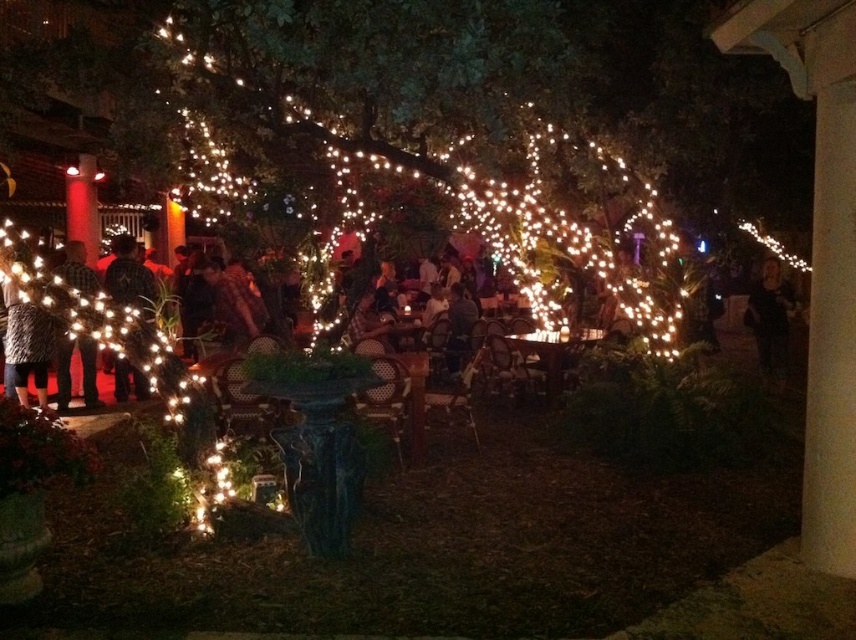
Can you confirm if black matte person at right is shorter than dark brown leather jacket at left?

No, black matte person at right is not shorter than dark brown leather jacket at left.

Between point (764, 339) and point (131, 284), which one is positioned behind?

The point (764, 339) is behind.

Between point (765, 352) and point (140, 275), which one is positioned behind?

Point (765, 352)

Locate an element on the screen. black matte person at right is located at coordinates (770, 317).

Is dark brown leather jacket at left wider than dark plaid shirt at left?

Yes, dark brown leather jacket at left is wider than dark plaid shirt at left.

Can you confirm if dark brown leather jacket at left is positioned below dark plaid shirt at left?

Actually, dark brown leather jacket at left is above dark plaid shirt at left.

Between point (147, 397) and point (82, 253), which one is positioned in front?

Point (82, 253) is in front.

Locate an element on the screen. dark brown leather jacket at left is located at coordinates (129, 276).

Is black matte person at right further to the viewer compared to dark plaid shirt at left?

Yes, black matte person at right is behind dark plaid shirt at left.

Is point (768, 355) in front of point (78, 273)?

That is False.

Does point (788, 330) come behind point (94, 358)?

Yes.

Where is `black matte person at right`? black matte person at right is located at coordinates (770, 317).